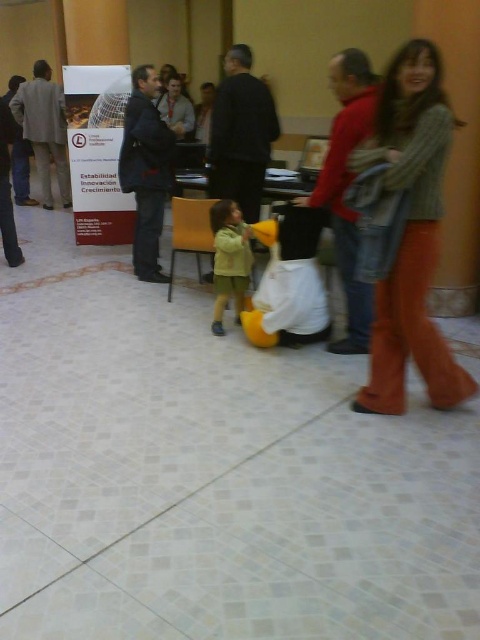
Question: Does matte gray suit at left appear on the right side of light green fabric jacket at center?

Choices:
 (A) yes
 (B) no

Answer: (B)

Question: Estimate the real-world distances between objects in this image. Which object is farther from the matte gray suit at left?

Choices:
 (A) orange cotton pants at right
 (B) light green fabric jacket at center

Answer: (A)

Question: Does orange cotton pants at right have a lesser width compared to matte gray suit at left?

Choices:
 (A) no
 (B) yes

Answer: (B)

Question: Can you confirm if orange cotton pants at right is smaller than matte gray suit at left?

Choices:
 (A) yes
 (B) no

Answer: (A)

Question: Which of the following is the closest to the observer?

Choices:
 (A) (460, 397)
 (B) (243, 248)
 (C) (41, 93)

Answer: (A)

Question: Which object is positioned closest to the light green fabric jacket at center?

Choices:
 (A) orange cotton pants at right
 (B) matte gray suit at left

Answer: (A)